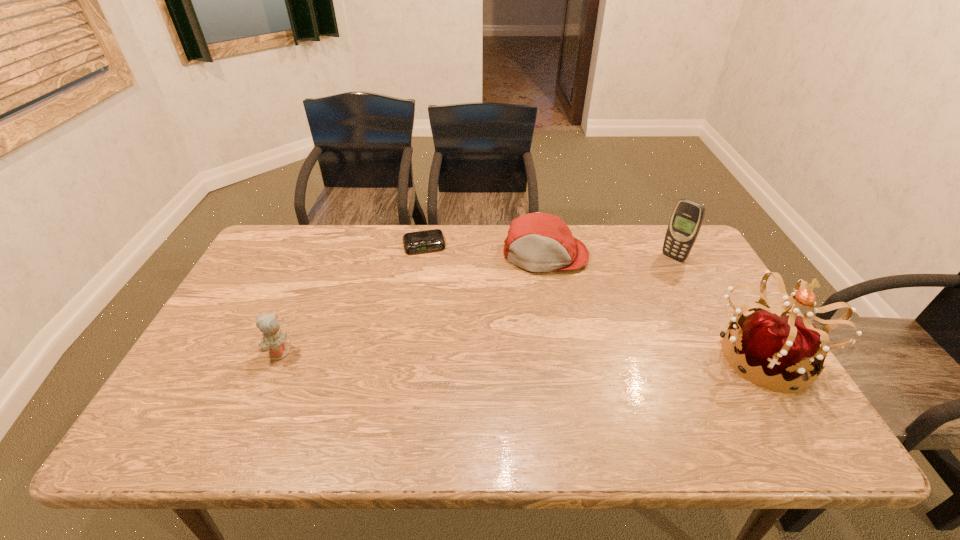
The height and width of the screenshot is (540, 960). I want to click on free space on the desktop that is between the teddy bear and the tallest object and is positioned on the screen of the cellular telephone, so click(x=567, y=353).

This screenshot has width=960, height=540. What are the coordinates of `vacant spot on the desktop that is between the leftmost object and the tallest object and is positioned on the display of the second object from left to right` in the screenshot? It's located at (449, 353).

At what (x,y) coordinates should I click in order to perform the action: click on free spot on the desktop that is between the leftmost object and the tiara and is positioned on the front-facing side of the cap. Please return your answer as a coordinate pair (x, y). Looking at the image, I should click on (537, 353).